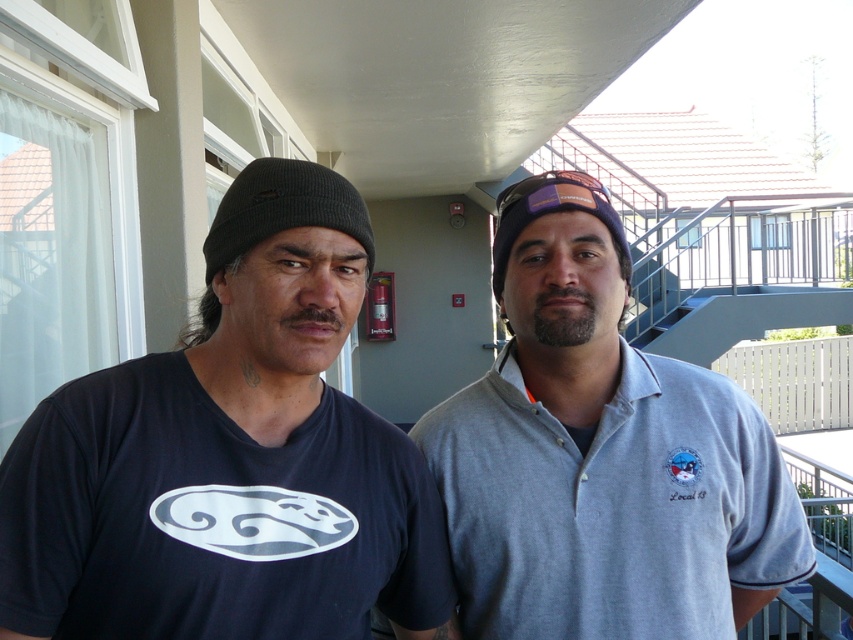
Question: Among these points, which one is farthest from the camera?

Choices:
 (A) (589, 208)
 (B) (32, 625)

Answer: (A)

Question: Where is gray cotton polo shirt at center located in relation to purple fabric cap at center in the image?

Choices:
 (A) right
 (B) left

Answer: (A)

Question: Does gray cotton polo shirt at center appear on the right side of black knit cap at left?

Choices:
 (A) yes
 (B) no

Answer: (A)

Question: Which object is closer to the camera taking this photo?

Choices:
 (A) black knit cap at left
 (B) gray cotton polo shirt at center
 (C) purple fabric cap at center

Answer: (A)

Question: Which object appears closest to the camera in this image?

Choices:
 (A) purple fabric cap at center
 (B) gray cotton polo shirt at center
 (C) black knit cap at left
 (D) dark blue t-shirt at left

Answer: (D)

Question: Is dark blue t-shirt at left smaller than black knit cap at left?

Choices:
 (A) yes
 (B) no

Answer: (B)